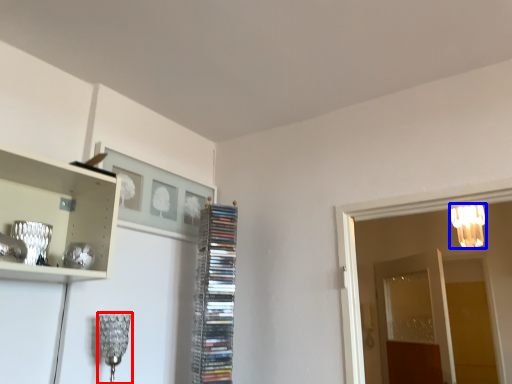
Question: Which of the following is the farthest to the observer, lamp (highlighted by a red box) or lamp (highlighted by a blue box)?

Choices:
 (A) lamp
 (B) lamp

Answer: (B)